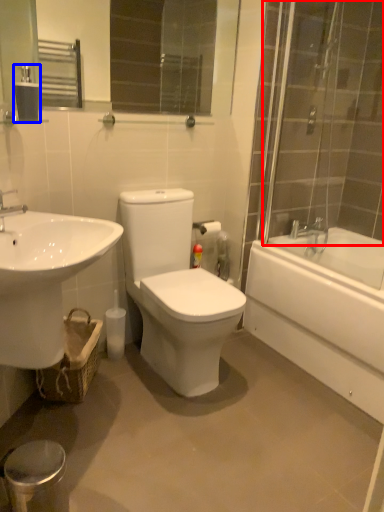
Question: Which object is closer to the camera taking this photo, shower door (highlighted by a red box) or tissue (highlighted by a blue box)?

Choices:
 (A) shower door
 (B) tissue

Answer: (A)